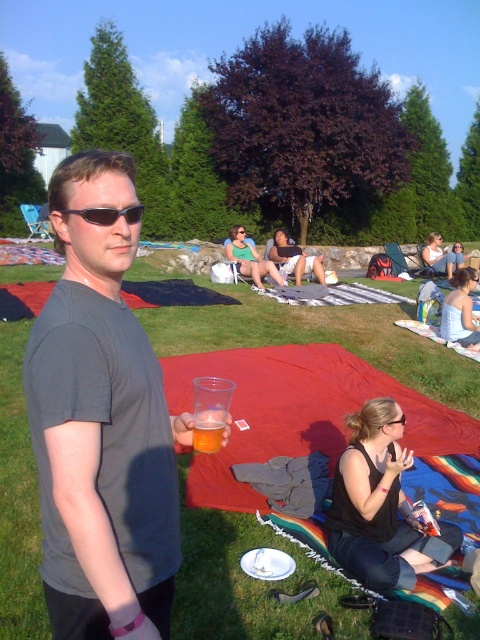
Question: Which of the following is the farthest from the observer?

Choices:
 (A) matte gray t-shirt at center
 (B) white fabric dress at lower right
 (C) black fabric at lower right

Answer: (B)

Question: Can you confirm if matte green bikini at center is positioned to the left of black plastic sunglasses at center?

Choices:
 (A) yes
 (B) no

Answer: (A)

Question: Can you confirm if green grass at center is wider than white fabric dress at lower right?

Choices:
 (A) yes
 (B) no

Answer: (A)

Question: Can you confirm if matte gray t-shirt at center is thinner than black fabric at lower right?

Choices:
 (A) yes
 (B) no

Answer: (A)

Question: Considering the real-world distances, which object is farthest from the matte black shorts at center?

Choices:
 (A) white fabric dress at lower right
 (B) matte green bikini at center
 (C) green grass at center
 (D) matte gray t-shirt at center

Answer: (D)

Question: Which of the following is the farthest from the observer?

Choices:
 (A) (432, 240)
 (B) (468, 330)

Answer: (A)